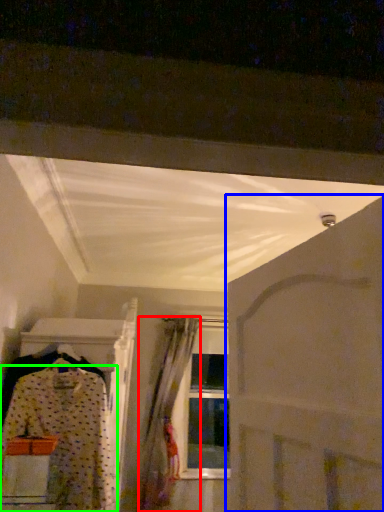
Question: Which object is positioned farthest from curtain (highlighted by a red box)? Select from door (highlighted by a blue box) and fancy dress (highlighted by a green box).

Choices:
 (A) door
 (B) fancy dress

Answer: (A)